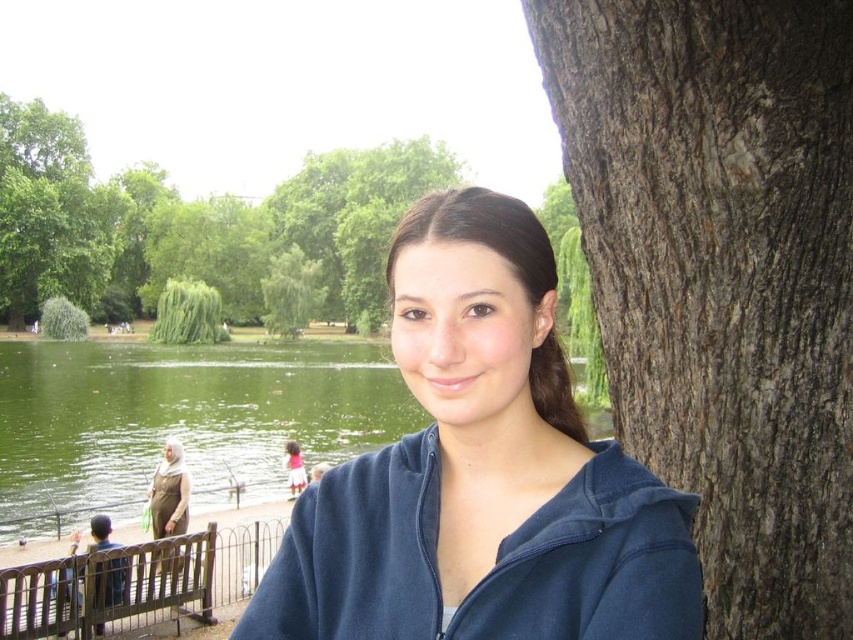
Is brown wooden bench at lower left further to camera compared to green leafy tree at center?

No, it is not.

Does brown wooden bench at lower left have a lesser height compared to green leafy tree at center?

Yes, brown wooden bench at lower left is shorter than green leafy tree at center.

Locate an element on the screen. brown wooden bench at lower left is located at coordinates (107, 586).

Does blue fleece jacket at center appear over matte blue sweatshirt at center?

Actually, blue fleece jacket at center is below matte blue sweatshirt at center.

Between blue fleece jacket at center and matte blue sweatshirt at center, which one is positioned lower?

blue fleece jacket at center

The height and width of the screenshot is (640, 853). Find the location of `blue fleece jacket at center`. blue fleece jacket at center is located at coordinates (482, 472).

Can you confirm if dark brown rough bark at right is positioned to the right of brown wooden bench at lower left?

Correct, you'll find dark brown rough bark at right to the right of brown wooden bench at lower left.

Which is more to the left, dark brown rough bark at right or brown wooden bench at lower left?

brown wooden bench at lower left

Locate an element on the screen. The width and height of the screenshot is (853, 640). dark brown rough bark at right is located at coordinates (723, 275).